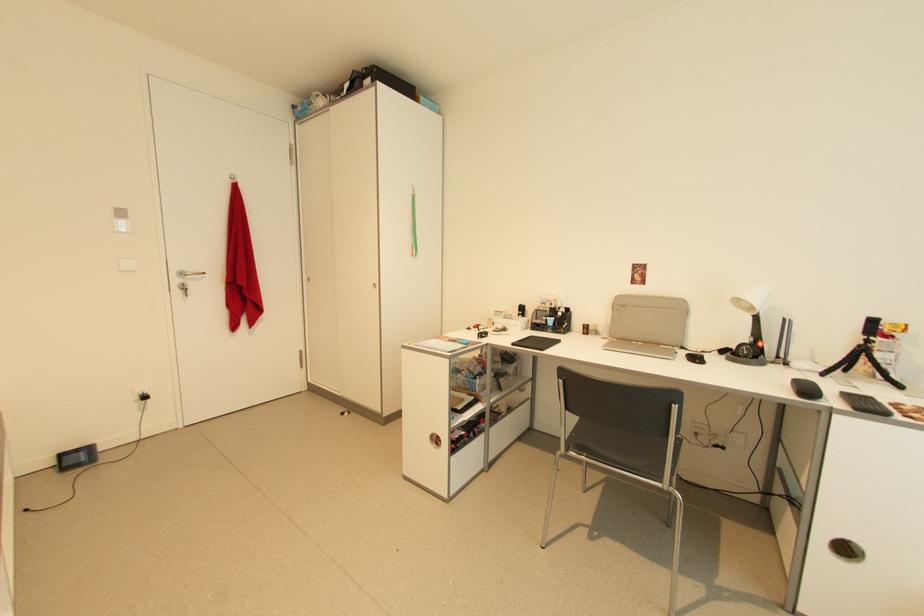
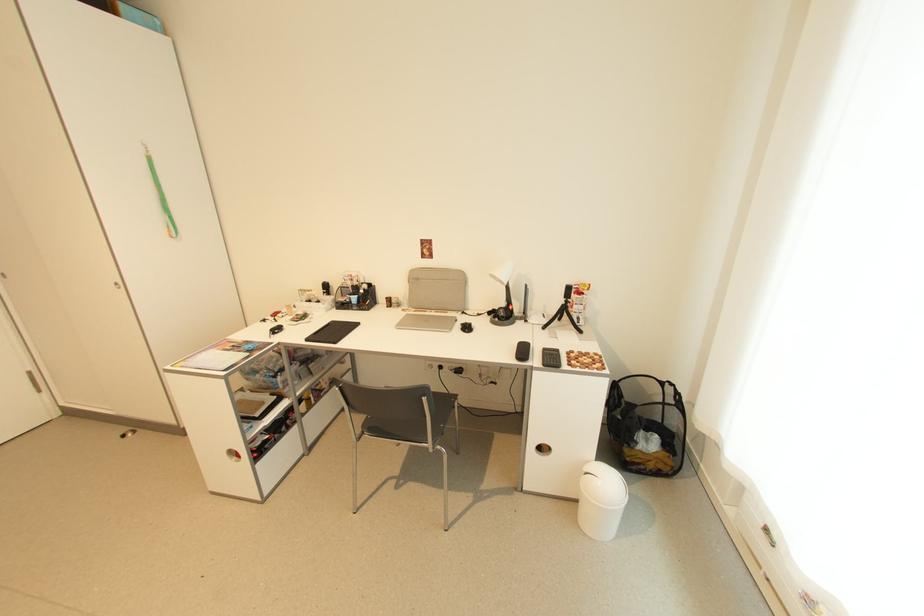
Locate, in the second image, the point that corresponds to (x=629, y=308) in the first image.

(422, 281)